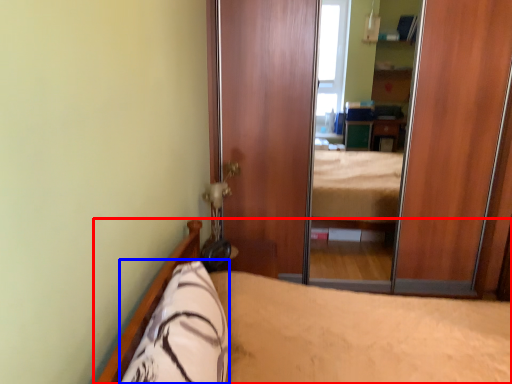
Question: Which object appears farthest to the camera in this image, bed (highlighted by a red box) or pillow (highlighted by a blue box)?

Choices:
 (A) bed
 (B) pillow

Answer: (B)